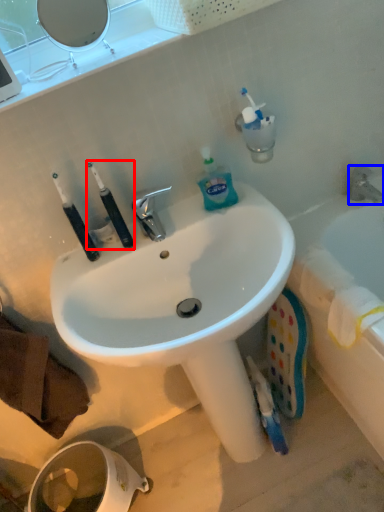
Question: Which object is closer to the camera taking this photo, toiletries (highlighted by a red box) or tap (highlighted by a blue box)?

Choices:
 (A) toiletries
 (B) tap

Answer: (A)